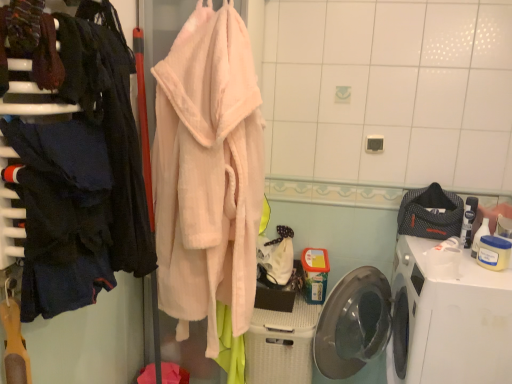
Question: In terms of width, does dark blue fabric at left, which ranks as the first clothing in front-to-back order, look wider or thinner when compared to soft pink plush robe at center, acting as the 2th closet starting from the front?

Choices:
 (A) thin
 (B) wide

Answer: (A)

Question: Is dark blue fabric at left, which ranks as the second clothing in back-to-front order, bigger or smaller than soft pink plush robe at center, acting as the 2th closet starting from the front?

Choices:
 (A) big
 (B) small

Answer: (B)

Question: Which object is positioned farthest from the soft pink plush robe at center, which is counted as the 1th closet, starting from the back?

Choices:
 (A) white plastic washing machine at lower right
 (B) textured gray bag at right, positioned as the 1th clothing in right-to-left order
 (C) white plastic basket at lower center
 (D) dark blue fabric at left, which is the first closet from front to back
 (E) dark blue fabric at left, marked as the first clothing in a left-to-right arrangement

Answer: (B)

Question: Estimate the real-world distances between objects in this image. Which object is closer to the dark blue fabric at left, the 2th clothing positioned from the right?

Choices:
 (A) white plastic washing machine at lower right
 (B) white plastic basket at lower center
 (C) peach fluffy bathrobe at center
 (D) soft pink plush robe at center, which is counted as the 1th closet, starting from the back
 (E) dark blue fabric at left, the second closet when ordered from back to front

Answer: (E)